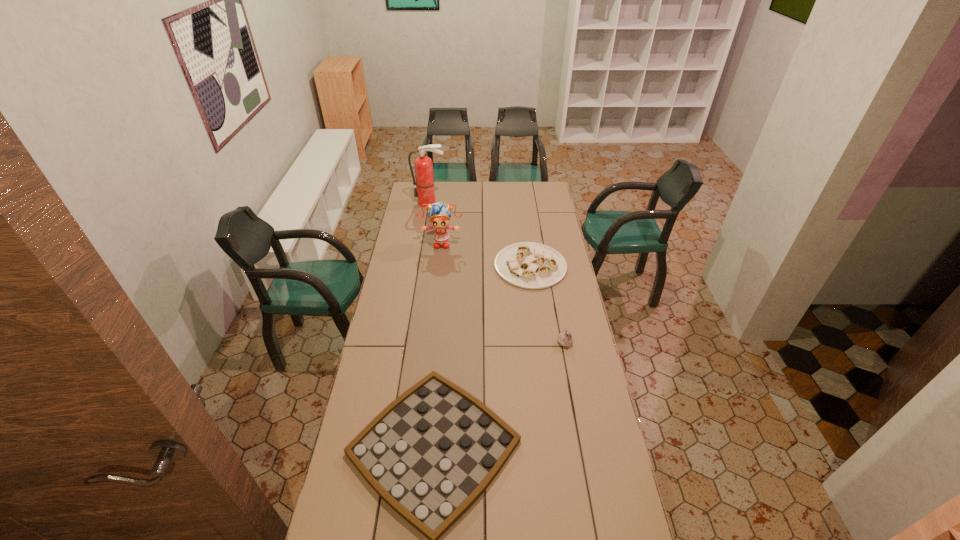
The image size is (960, 540). What are the coordinates of `object positioned at the far edge` in the screenshot? It's located at pyautogui.click(x=423, y=165).

Where is `fire extinguisher located in the left edge section of the desktop`? This screenshot has width=960, height=540. fire extinguisher located in the left edge section of the desktop is located at coordinates (423, 165).

The image size is (960, 540). I want to click on doll present at the left edge, so [439, 214].

Find the location of a particular element. This screenshot has width=960, height=540. garlic situated at the right edge is located at coordinates (564, 338).

Image resolution: width=960 pixels, height=540 pixels. Find the location of `platter located at the right edge`. platter located at the right edge is located at coordinates (529, 265).

I want to click on object that is at the far left corner, so click(423, 165).

Identify the location of vacant area at the far edge of the desktop. This screenshot has height=540, width=960. (477, 198).

This screenshot has width=960, height=540. Identify the location of free location at the left edge of the desktop. click(418, 227).

Locate an element on the screen. The image size is (960, 540). vacant point at the right edge is located at coordinates (611, 464).

Where is `free space between the tallest object and the fourth tallest object`? The width and height of the screenshot is (960, 540). free space between the tallest object and the fourth tallest object is located at coordinates (480, 234).